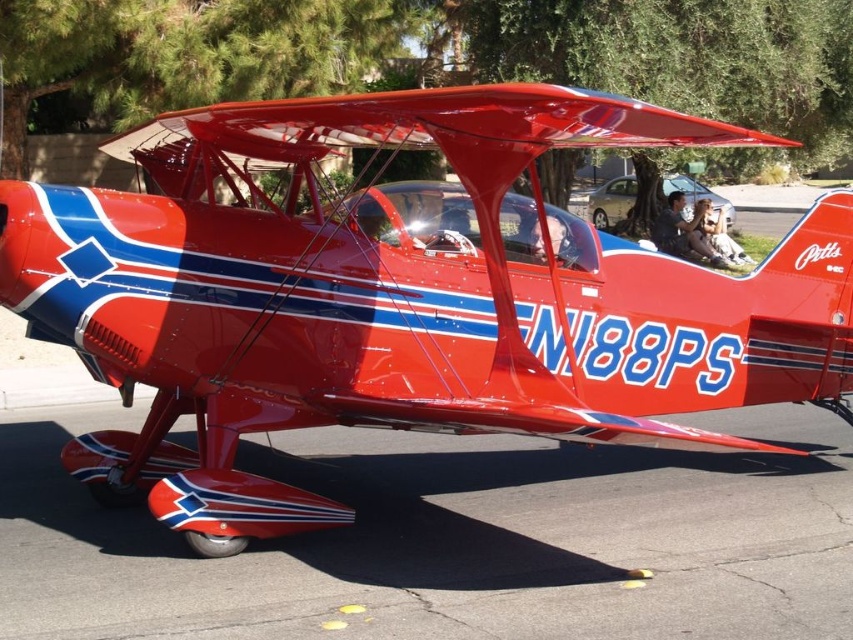
Question: Which of the following is the farthest from the observer?

Choices:
 (A) (572, 557)
 (B) (556, 218)

Answer: (B)

Question: Which object is farther from the camera taking this photo?

Choices:
 (A) transparent acrylic cockpit at center
 (B) glossy asphalt tarmac at lower center
 (C) glossy red helmet at center

Answer: (C)

Question: Observing the image, what is the correct spatial positioning of glossy red airplane at center in reference to transparent acrylic cockpit at center?

Choices:
 (A) below
 (B) above

Answer: (A)

Question: Which point is farther from the camera taking this photo?

Choices:
 (A) (660, 244)
 (B) (712, 385)

Answer: (A)

Question: Can you confirm if glossy asphalt tarmac at lower center is positioned to the right of glossy red helmet at center?

Choices:
 (A) no
 (B) yes

Answer: (A)

Question: Is glossy red airplane at center thinner than matte black pilot at center?

Choices:
 (A) yes
 (B) no

Answer: (B)